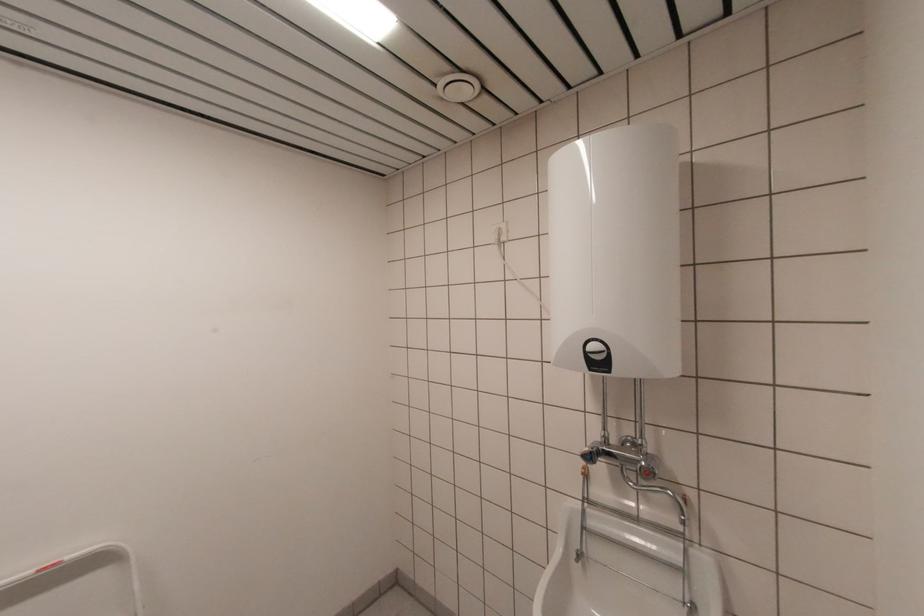
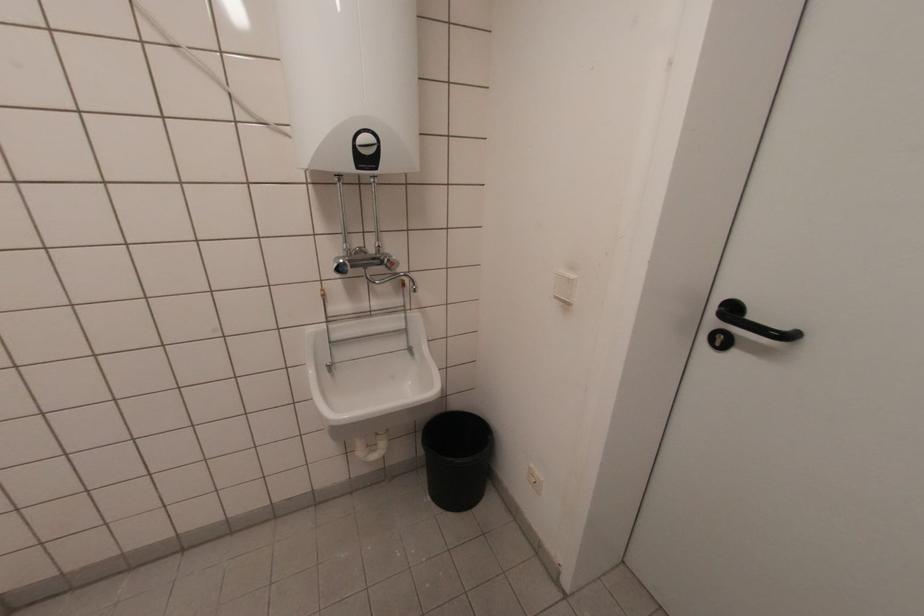
The point at [605,354] is marked in the first image. Where is the corresponding point in the second image?

(377, 148)